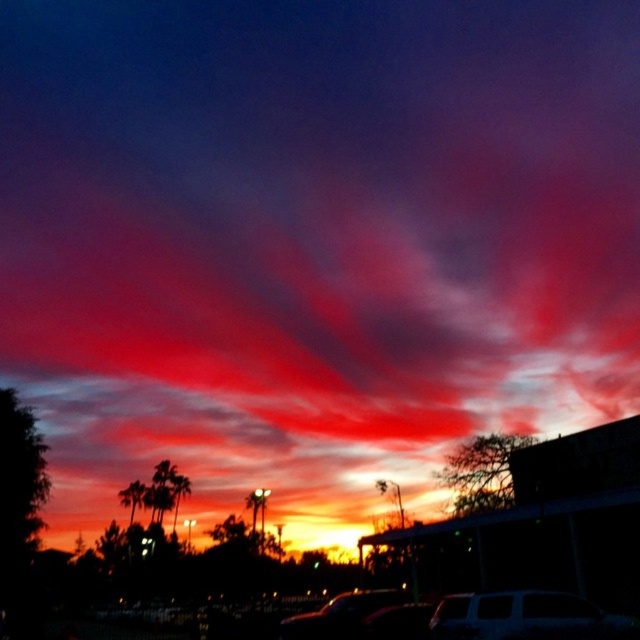
You are a delivery driver who needs to park your vehicle in a parking spot that is exactly 2 meters wide. You have a choice between parking the matte white van at lower center or the shiny black car at center. Based on the scene description, which vehicle would you choose to ensure it fits properly?

The matte white van at lower center has a smaller width than the shiny black car at center, so the matte white van at lower center would fit better in the 2 meter wide parking spot.

Where is the matte white van at lower center located in the image?

The matte white van at lower center is located at point (513, 614).